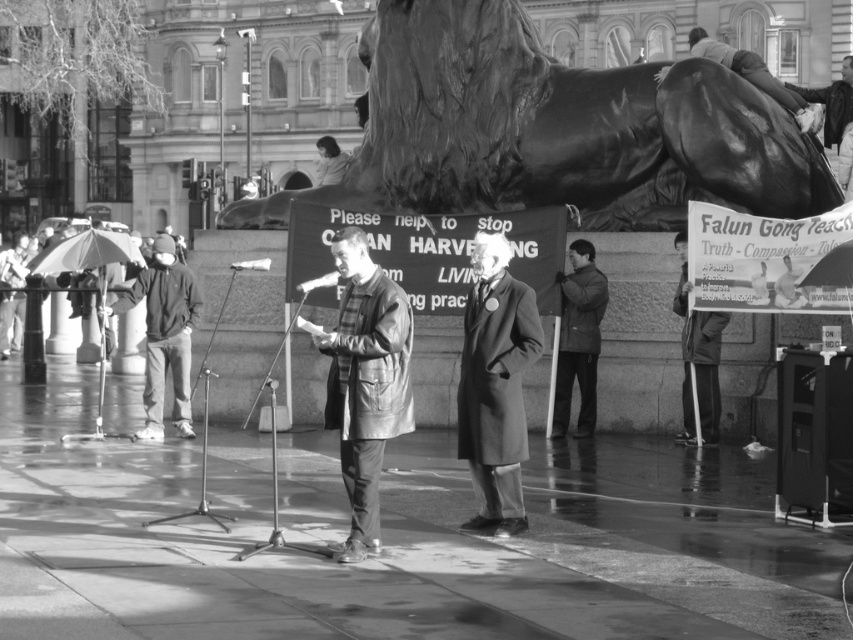
Question: Considering the relative positions of polished bronze horse at upper center and leather jacket at center in the image provided, where is polished bronze horse at upper center located with respect to leather jacket at center?

Choices:
 (A) left
 (B) right

Answer: (B)

Question: Which point appears closest to the camera in this image?

Choices:
 (A) (781, 83)
 (B) (190, 284)
 (C) (700, 310)

Answer: (C)

Question: Is smooth gray coat at center below smooth black coat at right?

Choices:
 (A) no
 (B) yes

Answer: (B)

Question: Estimate the real-world distances between objects in this image. Which object is farther from the metallic shiny microphone at center?

Choices:
 (A) dark gray jacket at center
 (B) smooth gray coat at center

Answer: (A)

Question: Which of the following is the farthest from the observer?

Choices:
 (A) (582, 280)
 (B) (361, 381)
 (C) (320, 276)
 (D) (485, 448)

Answer: (C)

Question: Is polished bronze horse at upper center smaller than dark gray jacket at center?

Choices:
 (A) no
 (B) yes

Answer: (A)